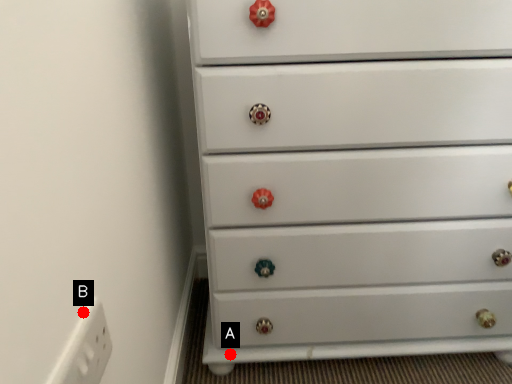
Question: Two points are circled on the image, labeled by A and B beside each circle. Which point is farther to the camera?

Choices:
 (A) A is further
 (B) B is further

Answer: (A)